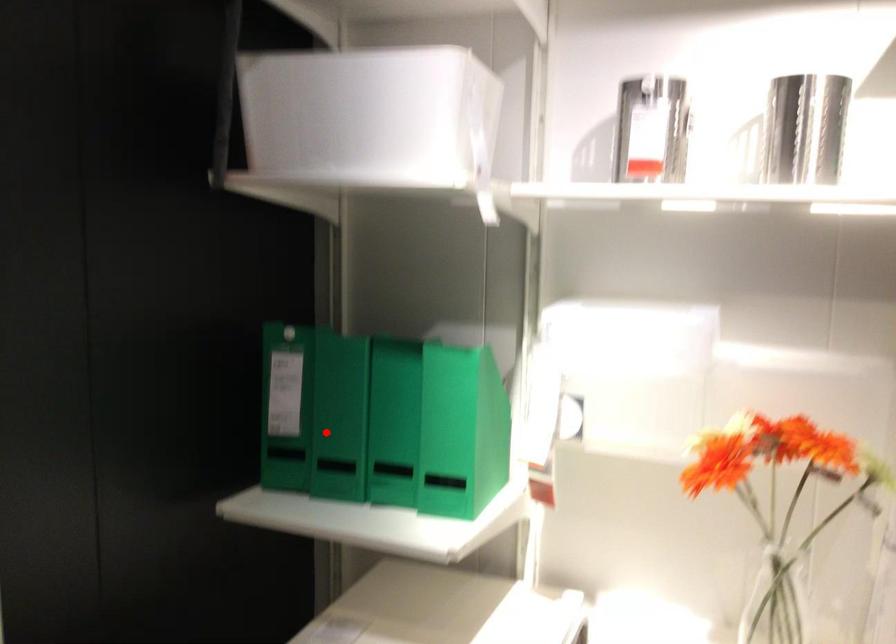
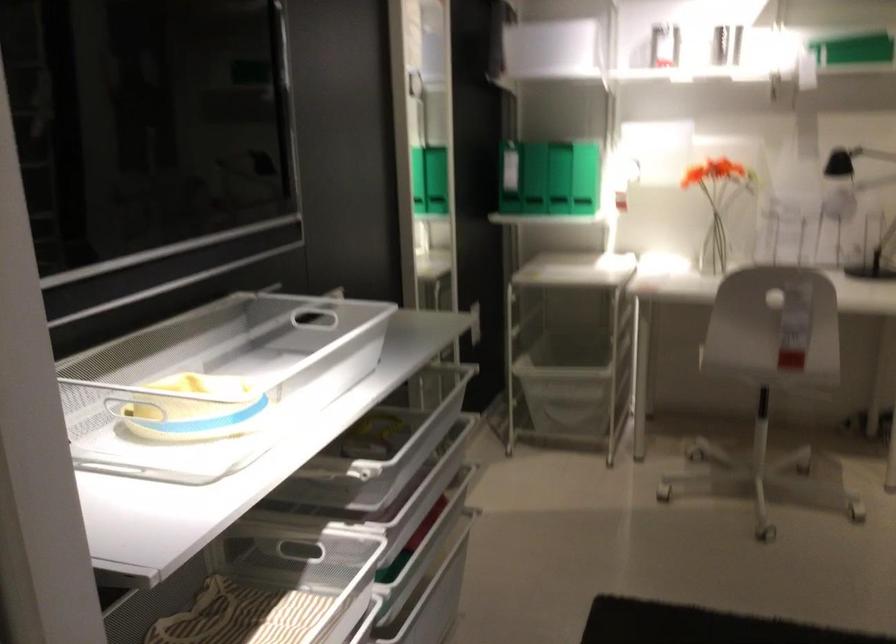
Find the pixel in the second image that matches the highlighted location in the first image.

(533, 178)